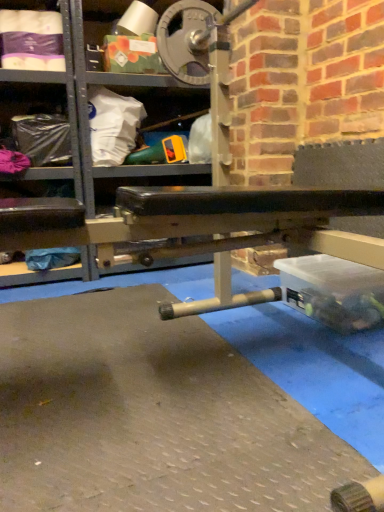
Question: Is clear plastic bag at left, which ranks as the 2th shelf in right-to-left order, taller than black rubber bench at center, which is the second shelf in left-to-right order?

Choices:
 (A) yes
 (B) no

Answer: (B)

Question: Is clear plastic bag at left, which ranks as the 2th shelf in right-to-left order, aimed at black rubber bench at center, placed as the 1th shelf when sorted from right to left?

Choices:
 (A) no
 (B) yes

Answer: (A)

Question: From a real-world perspective, is clear plastic bag at left, the 1th shelf when ordered from left to right, below black rubber bench at center, which is the second shelf in left-to-right order?

Choices:
 (A) yes
 (B) no

Answer: (A)

Question: Considering the relative positions of clear plastic bag at left, the 1th shelf when ordered from left to right, and black rubber bench at center, which is the second shelf in left-to-right order, in the image provided, is clear plastic bag at left, the 1th shelf when ordered from left to right, behind black rubber bench at center, which is the second shelf in left-to-right order,?

Choices:
 (A) no
 (B) yes

Answer: (B)

Question: Is clear plastic bag at left, the 1th shelf when ordered from left to right, smaller than black rubber bench at center, placed as the 1th shelf when sorted from right to left?

Choices:
 (A) no
 (B) yes

Answer: (B)

Question: Does clear plastic bag at left, which ranks as the 2th shelf in right-to-left order, appear on the right side of black rubber bench at center, which is the second shelf in left-to-right order?

Choices:
 (A) yes
 (B) no

Answer: (B)

Question: From a real-world perspective, is black rubber bench at center, which is the second shelf in left-to-right order, on top of clear plastic bag at left, which ranks as the 2th shelf in right-to-left order?

Choices:
 (A) no
 (B) yes

Answer: (B)

Question: Considering the relative sizes of black rubber bench at center, placed as the 1th shelf when sorted from right to left, and clear plastic bag at left, which ranks as the 2th shelf in right-to-left order, in the image provided, is black rubber bench at center, placed as the 1th shelf when sorted from right to left, thinner than clear plastic bag at left, which ranks as the 2th shelf in right-to-left order,?

Choices:
 (A) yes
 (B) no

Answer: (B)

Question: Is black rubber bench at center, placed as the 1th shelf when sorted from right to left, outside clear plastic bag at left, the 1th shelf when ordered from left to right?

Choices:
 (A) no
 (B) yes

Answer: (B)

Question: From a real-world perspective, is black rubber bench at center, which is the second shelf in left-to-right order, below clear plastic bag at left, the 1th shelf when ordered from left to right?

Choices:
 (A) yes
 (B) no

Answer: (B)

Question: Can you confirm if black rubber bench at center, which is the second shelf in left-to-right order, is smaller than clear plastic bag at left, which ranks as the 2th shelf in right-to-left order?

Choices:
 (A) no
 (B) yes

Answer: (A)

Question: Is black rubber bench at center, placed as the 1th shelf when sorted from right to left, oriented away from clear plastic bag at left, the 1th shelf when ordered from left to right?

Choices:
 (A) no
 (B) yes

Answer: (A)

Question: In the image, is clear plastic bag at left, the 1th shelf when ordered from left to right, on the left side or the right side of black rubber bench at center, placed as the 1th shelf when sorted from right to left?

Choices:
 (A) right
 (B) left

Answer: (B)